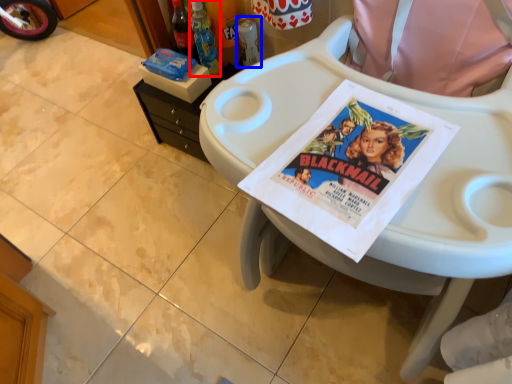
Question: Which of the following is the closest to the observer, bottle (highlighted by a red box) or bottle (highlighted by a blue box)?

Choices:
 (A) bottle
 (B) bottle

Answer: (A)